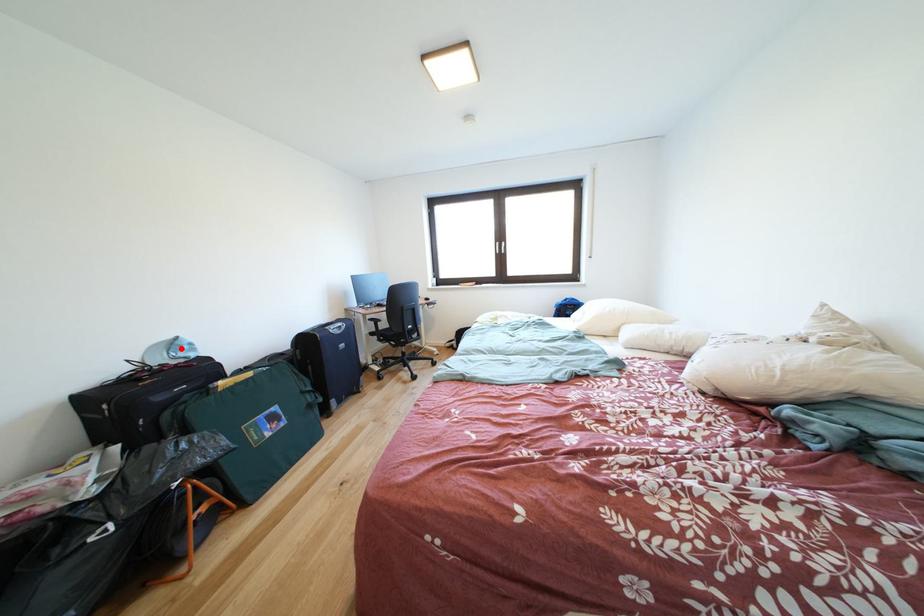
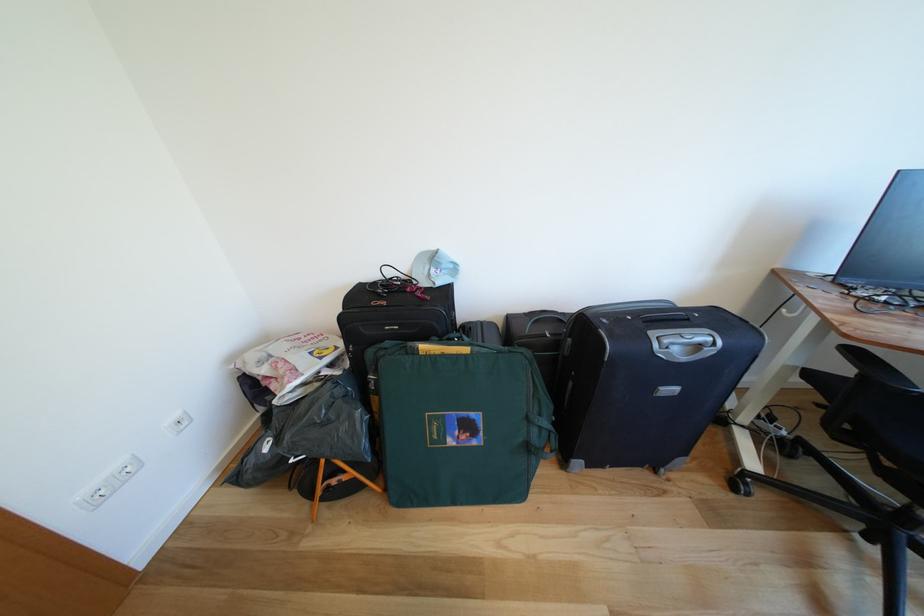
Locate, in the second image, the point that corresponds to the highlighted location in the first image.

(442, 262)